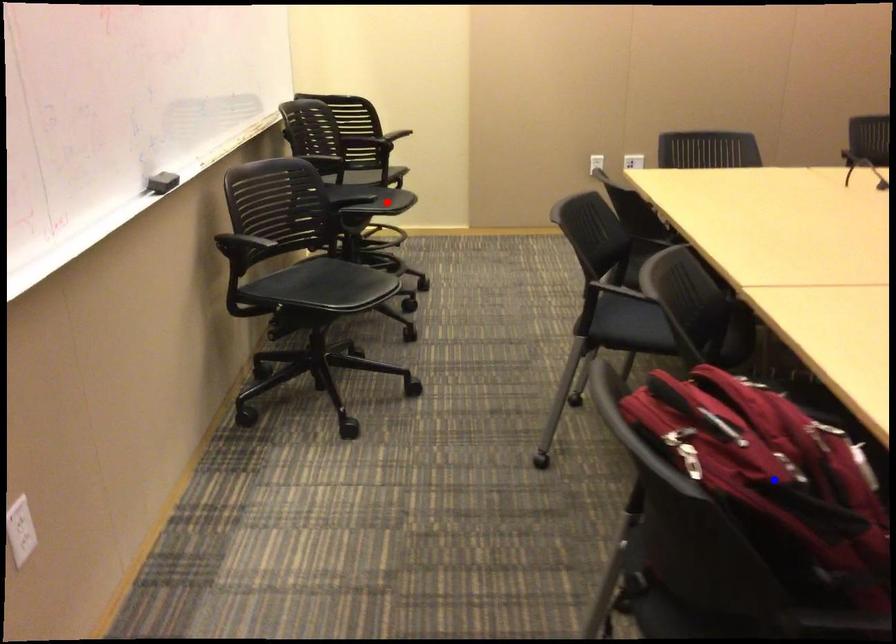
Question: In the image, two points are highlighted. Which point is nearer to the camera? Reply with the corresponding letter.

Choices:
 (A) blue point
 (B) red point

Answer: (A)